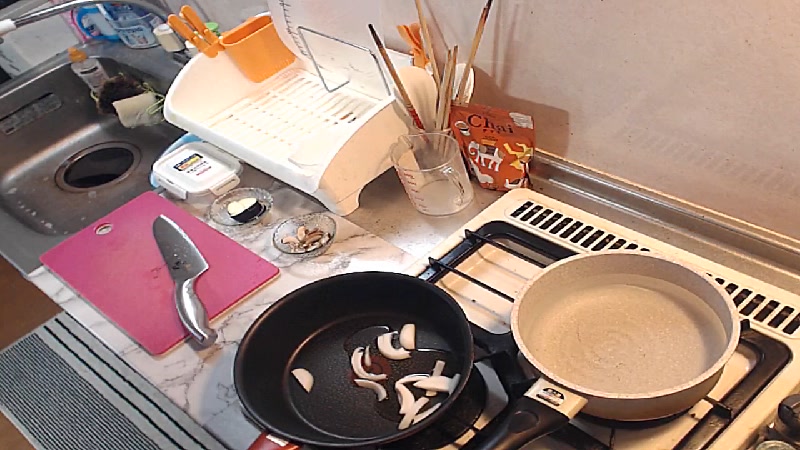
Where is `dish drying rack`? This screenshot has height=450, width=800. dish drying rack is located at coordinates (270, 107).